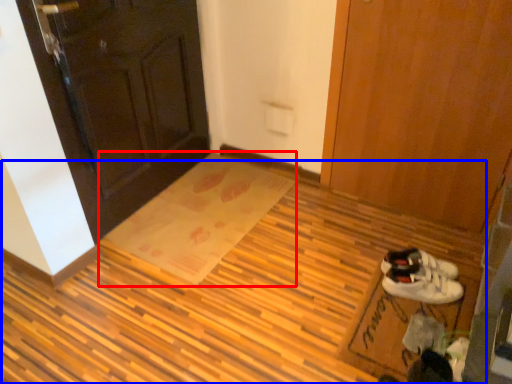
Question: Which of the following is the closest to the observer, doormat (highlighted by a red box) or plywood (highlighted by a blue box)?

Choices:
 (A) doormat
 (B) plywood

Answer: (B)